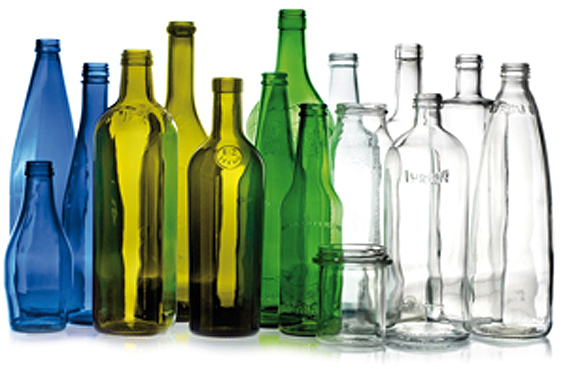
Find the location of a particular element. colored glass container is located at coordinates (37, 215), (43, 122), (82, 182), (137, 139), (185, 109), (227, 130), (298, 65), (273, 143), (315, 159).